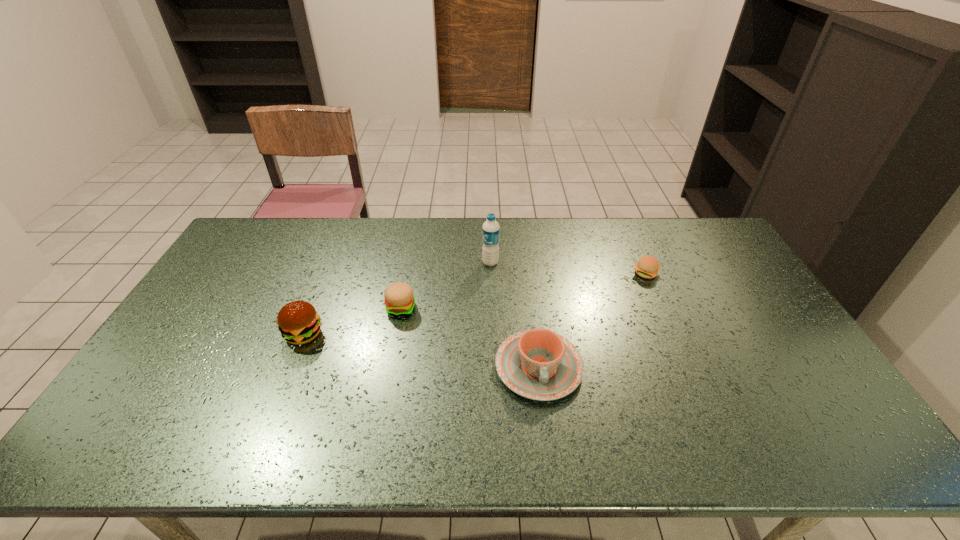
This screenshot has height=540, width=960. Find the location of `the tallest object`. the tallest object is located at coordinates (490, 230).

Image resolution: width=960 pixels, height=540 pixels. I want to click on the nearest hamburger, so click(x=298, y=322).

Identify the location of the leftmost hamburger. Image resolution: width=960 pixels, height=540 pixels. (x=298, y=322).

You are a GUI agent. You are given a task and a screenshot of the screen. Output one action in this format:
    pyautogui.click(x=<x>, y=<y>)
    Task: Click on the chinaware
    Image resolution: width=960 pixels, height=540 pixels.
    Given the screenshot: What is the action you would take?
    pyautogui.click(x=538, y=364)

Locate an element on the screen. The width and height of the screenshot is (960, 540). the second shortest hamburger is located at coordinates (399, 300).

Locate an element on the screen. This screenshot has width=960, height=540. the second object from left to right is located at coordinates (399, 300).

Identify the location of the shortest hamburger. (647, 267).

Image resolution: width=960 pixels, height=540 pixels. What are the coordinates of `the farthest hamburger` in the screenshot? It's located at (647, 267).

I want to click on free spot located on the label of the tallest object, so click(453, 262).

This screenshot has width=960, height=540. I want to click on vacant position located 0.310m on the label of the tallest object, so click(x=392, y=262).